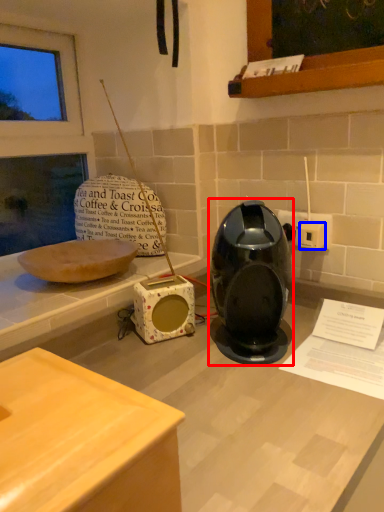
Question: Which point is further to the camera, home appliance (highlighted by a red box) or electric outlet (highlighted by a blue box)?

Choices:
 (A) home appliance
 (B) electric outlet

Answer: (B)